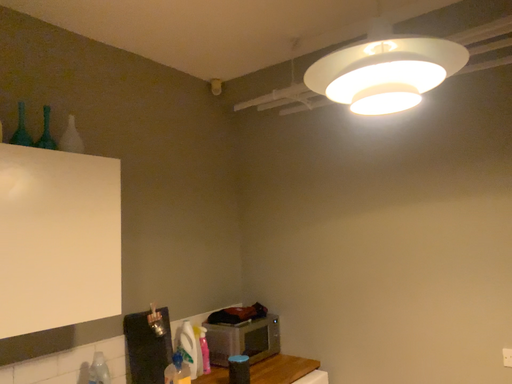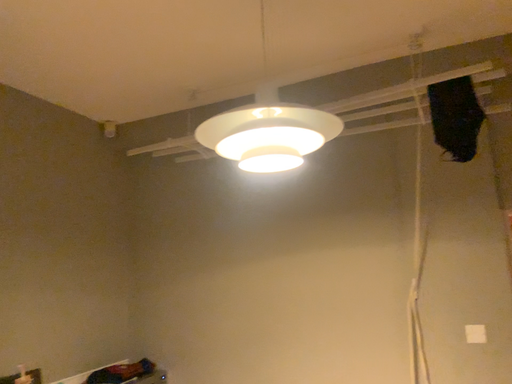
Question: Which way did the camera rotate in the video?

Choices:
 (A) rotated left
 (B) rotated right

Answer: (B)